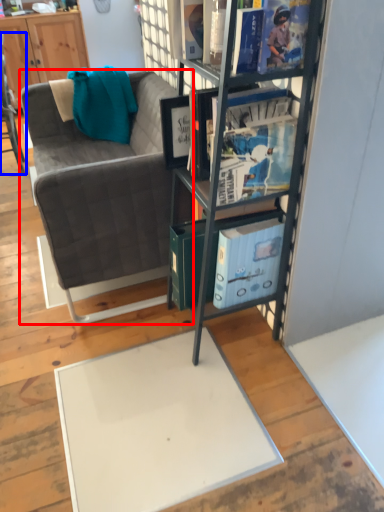
Question: Among these objects, which one is nearest to the camera, studio couch (highlighted by a red box) or chair (highlighted by a blue box)?

Choices:
 (A) studio couch
 (B) chair

Answer: (A)